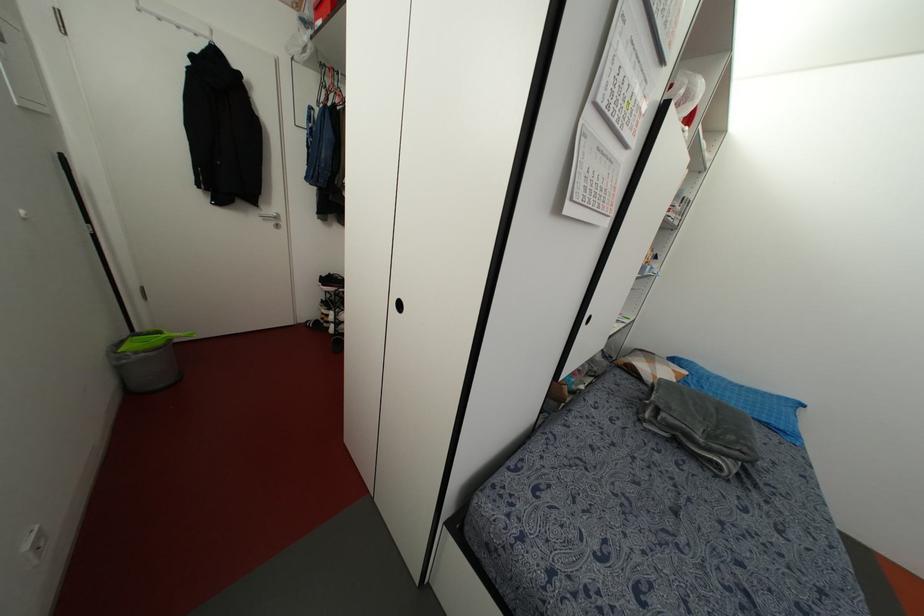
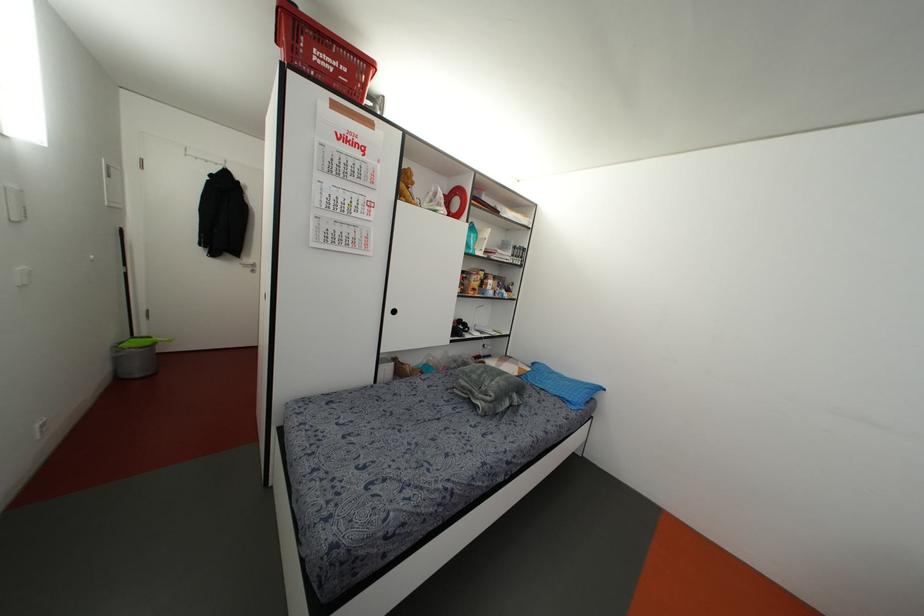
In the second image, find the point that corresponds to pixel 168 339 in the first image.

(153, 342)